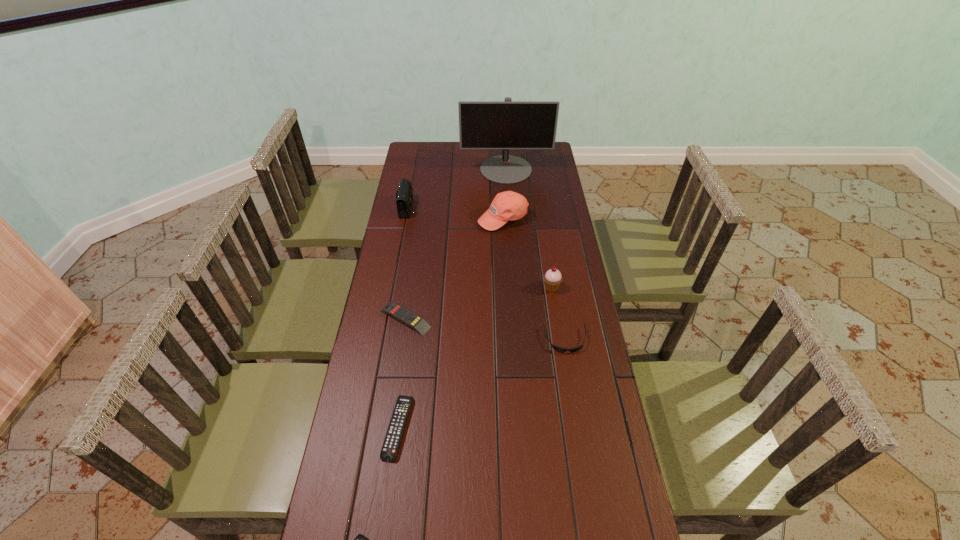
The width and height of the screenshot is (960, 540). In order to click on cupcake at the right edge in this screenshot , I will do `click(552, 278)`.

Where is `sunglasses located in the right edge section of the desktop`? The image size is (960, 540). sunglasses located in the right edge section of the desktop is located at coordinates (559, 349).

This screenshot has height=540, width=960. What are the coordinates of `object located in the far right corner section of the desktop` in the screenshot? It's located at (507, 124).

Locate an element on the screen. The image size is (960, 540). vacant space at the far edge of the desktop is located at coordinates (452, 160).

In the image, there is a desktop. Identify the location of vacant area at the left edge. (416, 203).

Identify the location of vacant region at the right edge. pyautogui.click(x=546, y=338).

In order to click on vacant space at the far left corner in this screenshot , I will do `click(429, 143)`.

Locate an element on the screen. Image resolution: width=960 pixels, height=540 pixels. vacant space at the far right corner is located at coordinates (556, 166).

The height and width of the screenshot is (540, 960). I want to click on empty space between the fifth nearest object and the gray computer monitor, so click(529, 228).

I want to click on vacant area that lies between the yellow remote control and the clutch bag, so click(407, 263).